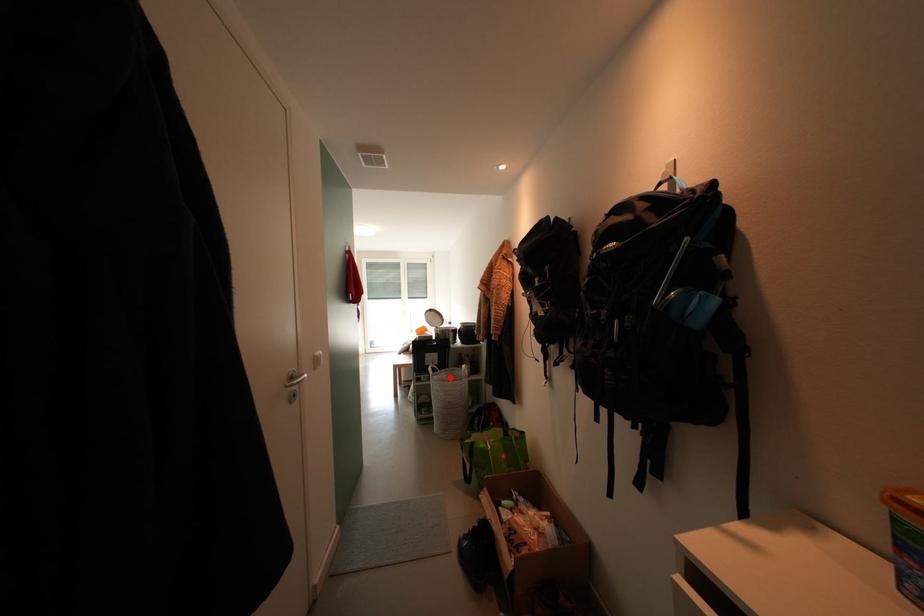
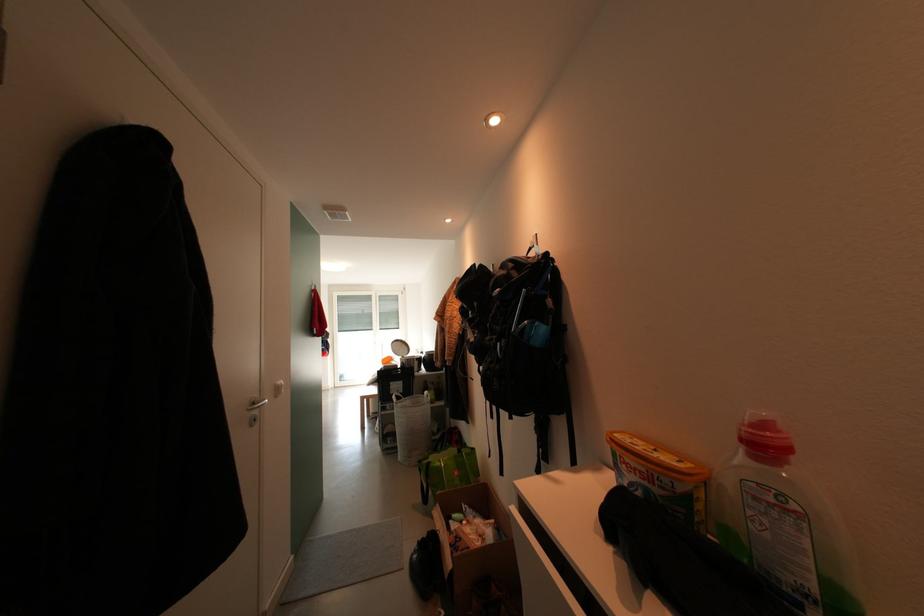
Find the pixel in the second image that matches the highlighted location in the first image.

(415, 405)